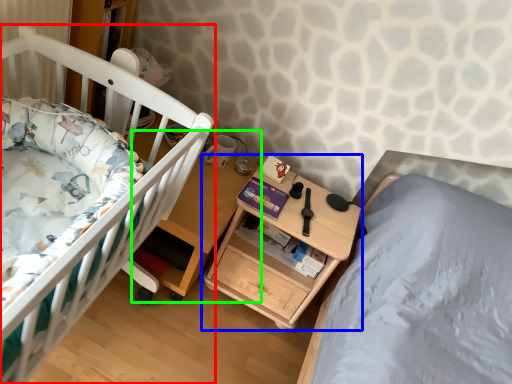
Question: Estimate the real-world distances between objects in this image. Which object is farther from infant bed (highlighted by a red box), nightstand (highlighted by a blue box) or table (highlighted by a green box)?

Choices:
 (A) nightstand
 (B) table

Answer: (A)